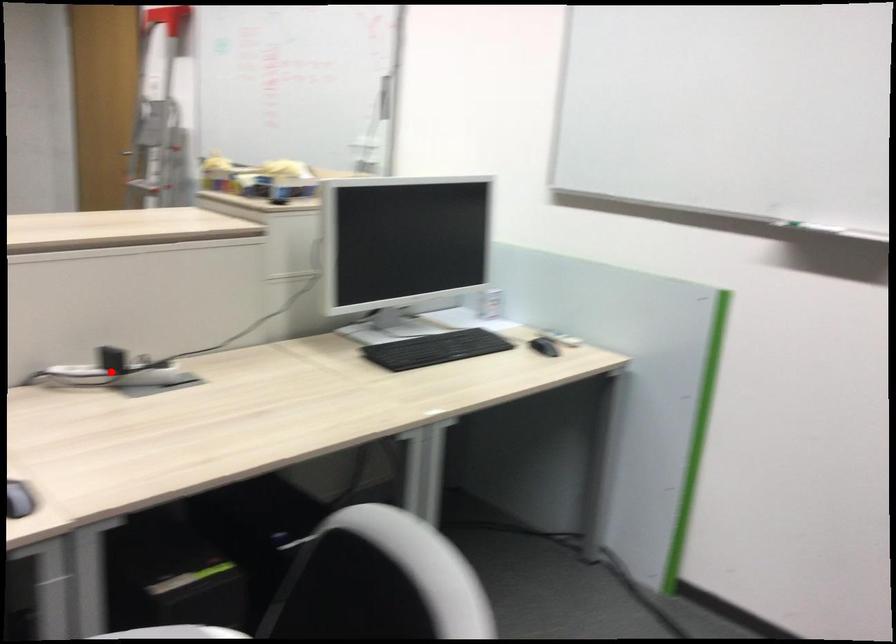
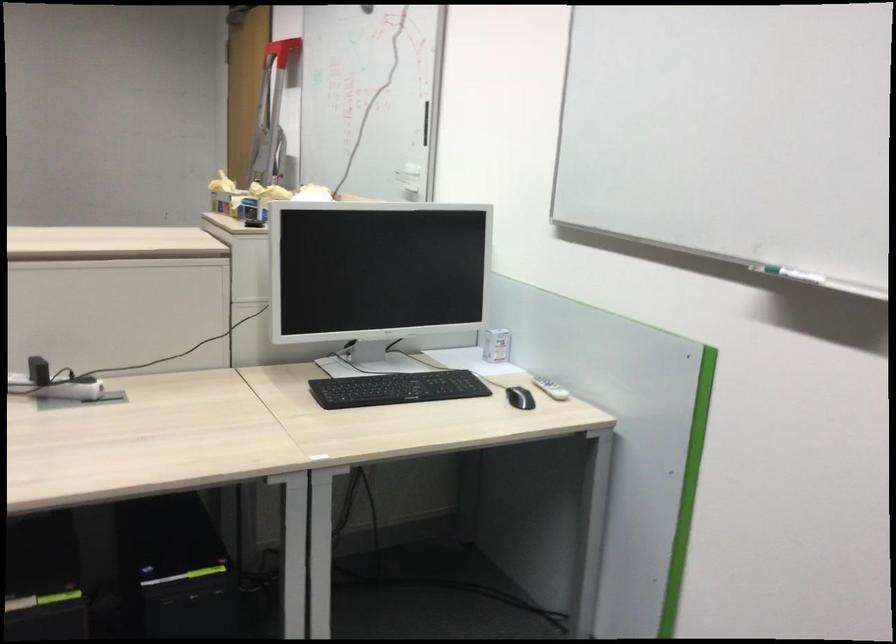
Locate, in the second image, the point that corresponds to the highlighted location in the first image.

(53, 383)